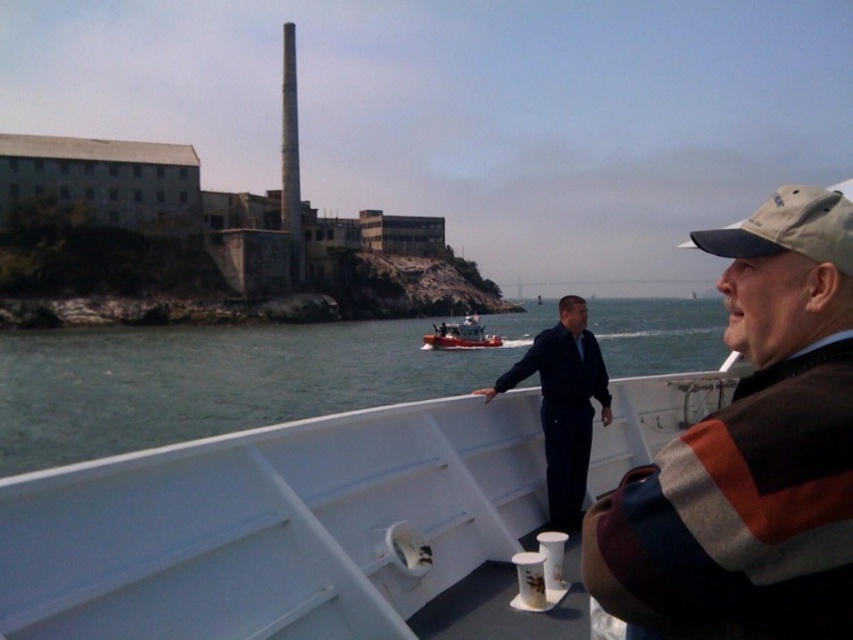
Which is behind, point (630, 490) or point (457, 346)?

Positioned behind is point (457, 346).

Can you confirm if brown striped sweater at right is taller than metallic red boat at center?

Yes, brown striped sweater at right is taller than metallic red boat at center.

Locate an element on the screen. The image size is (853, 640). brown striped sweater at right is located at coordinates (752, 452).

Is brown striped sweater at right behind dark blue suit at center?

No, brown striped sweater at right is closer to the viewer.

Based on the photo, who is more distant from viewer, (822, 304) or (584, 360)?

The point (584, 360) is more distant.

Is point (740, 556) farther from viewer compared to point (556, 468)?

No, it is not.

At what (x,y) coordinates should I click in order to perform the action: click on brown striped sweater at right. Please return your answer as a coordinate pair (x, y). The image size is (853, 640). Looking at the image, I should click on (752, 452).

Is brown striped sweater at right smaller than green water at center?

Yes.

Between point (662, 544) and point (442, 353), which one is positioned behind?

Positioned behind is point (442, 353).

The height and width of the screenshot is (640, 853). Identify the location of brown striped sweater at right. (752, 452).